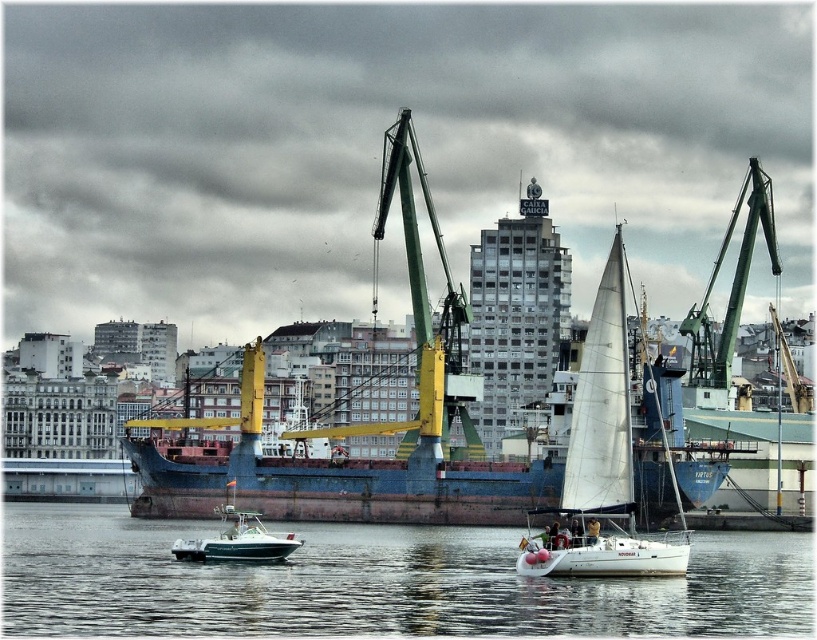
Question: Is clear water at lower center smaller than blue matte cargo ship at center?

Choices:
 (A) no
 (B) yes

Answer: (B)

Question: Which is farther from the green plastic motorboat at lower center?

Choices:
 (A) blue matte cargo ship at center
 (B) green metallic crane at upper right
 (C) white sailboat at center

Answer: (B)

Question: Can you confirm if white sailboat at center is positioned below green plastic motorboat at lower center?

Choices:
 (A) yes
 (B) no

Answer: (B)

Question: Which object is closer to the camera taking this photo?

Choices:
 (A) green metallic crane at upper right
 (B) white sailboat at center

Answer: (B)

Question: Among these objects, which one is farthest from the camera?

Choices:
 (A) green plastic motorboat at lower center
 (B) clear water at lower center

Answer: (A)

Question: Does blue matte cargo ship at center have a larger size compared to green metallic crane at upper right?

Choices:
 (A) yes
 (B) no

Answer: (A)